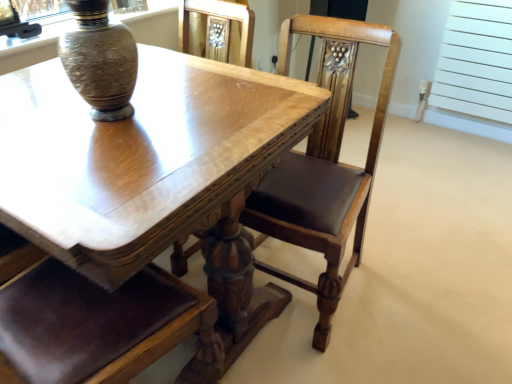
The image size is (512, 384). Identify the location of free location to the left of speckled ceramic vase at upper left. (45, 109).